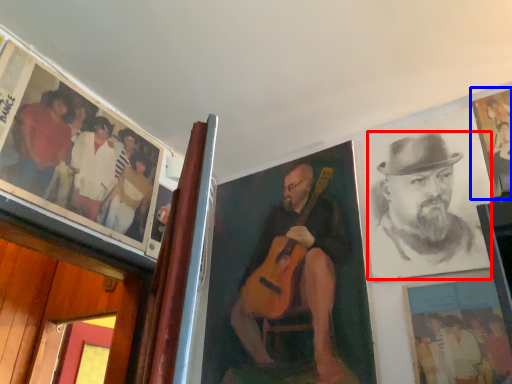
Question: Which object is closer to the camera taking this photo, man (highlighted by a red box) or picture frame (highlighted by a blue box)?

Choices:
 (A) man
 (B) picture frame

Answer: (A)